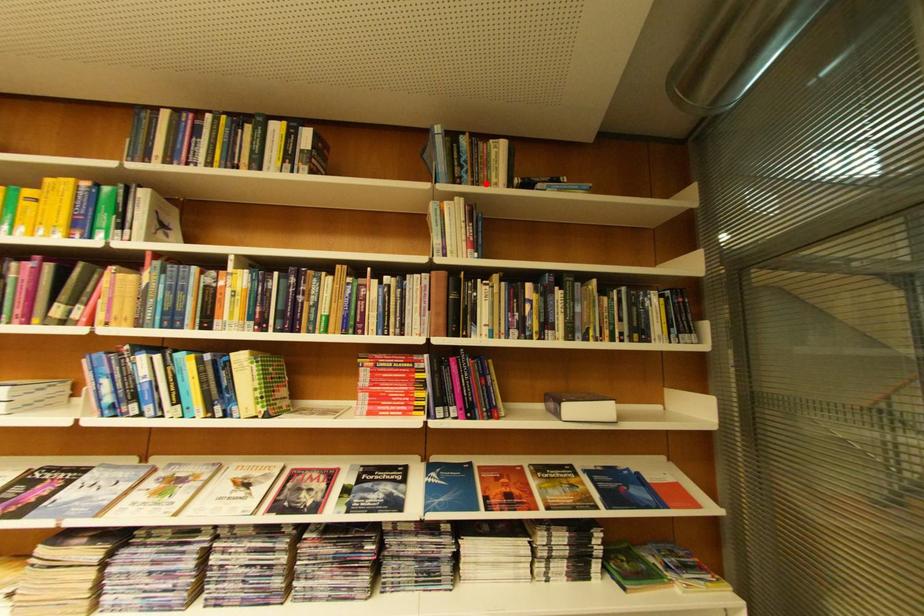
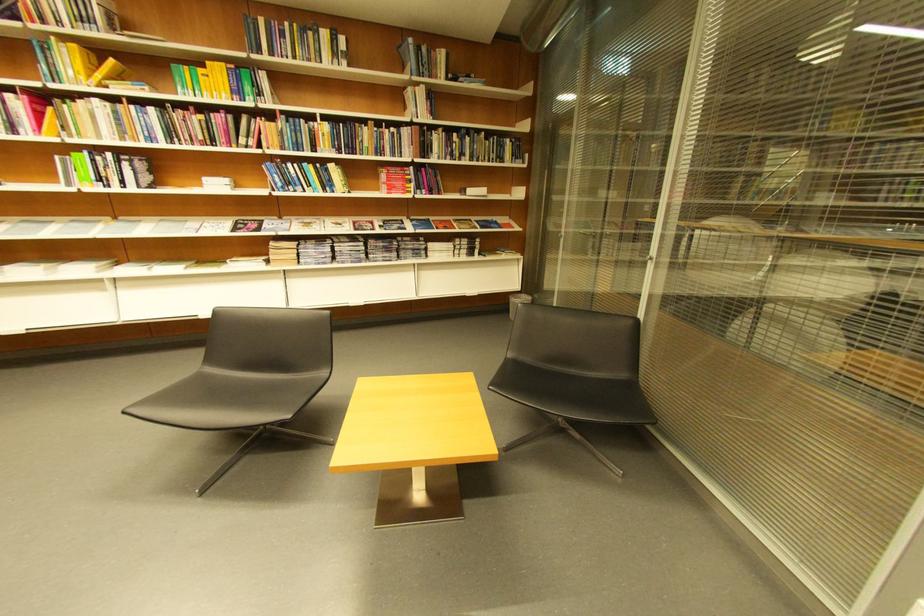
Where in the second image is the point corresponding to the highlighted location from the first image?

(441, 78)